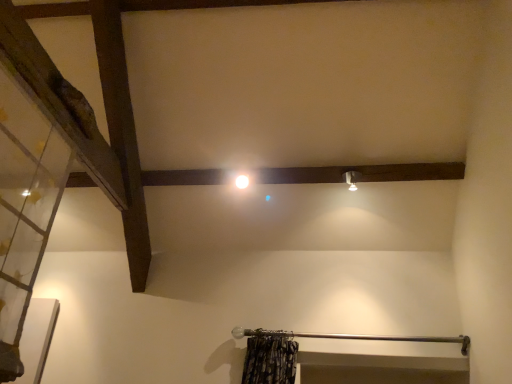
Question: In the image, is transparent glass door at left positioned in front of or behind matte silver light fixture at upper right?

Choices:
 (A) front
 (B) behind

Answer: (A)

Question: In terms of height, does transparent glass door at left look taller or shorter compared to matte silver light fixture at upper right?

Choices:
 (A) tall
 (B) short

Answer: (A)

Question: Which object is the farthest from the white glossy light at center?

Choices:
 (A) transparent glass door at left
 (B) matte silver light fixture at upper right
 (C) metallic curtain rod at lower center

Answer: (A)

Question: Which object is the farthest from the white glossy light at center?

Choices:
 (A) matte silver light fixture at upper right
 (B) metallic curtain rod at lower center
 (C) transparent glass door at left

Answer: (C)